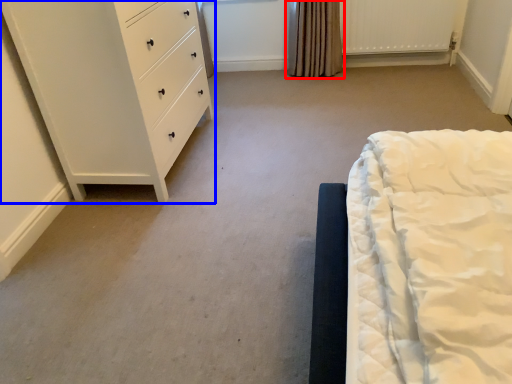
Question: Among these objects, which one is nearest to the camera, curtain (highlighted by a red box) or chest of drawers (highlighted by a blue box)?

Choices:
 (A) curtain
 (B) chest of drawers

Answer: (B)